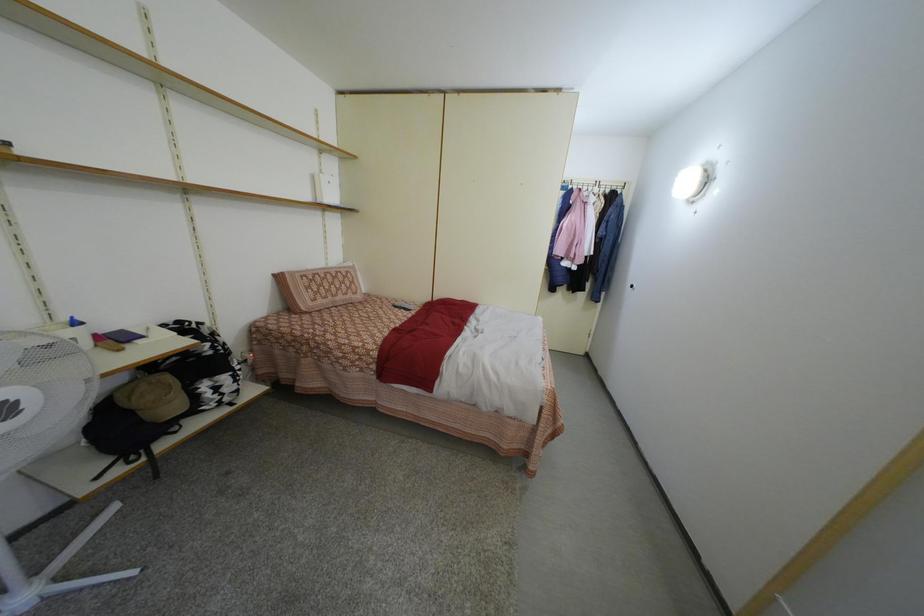
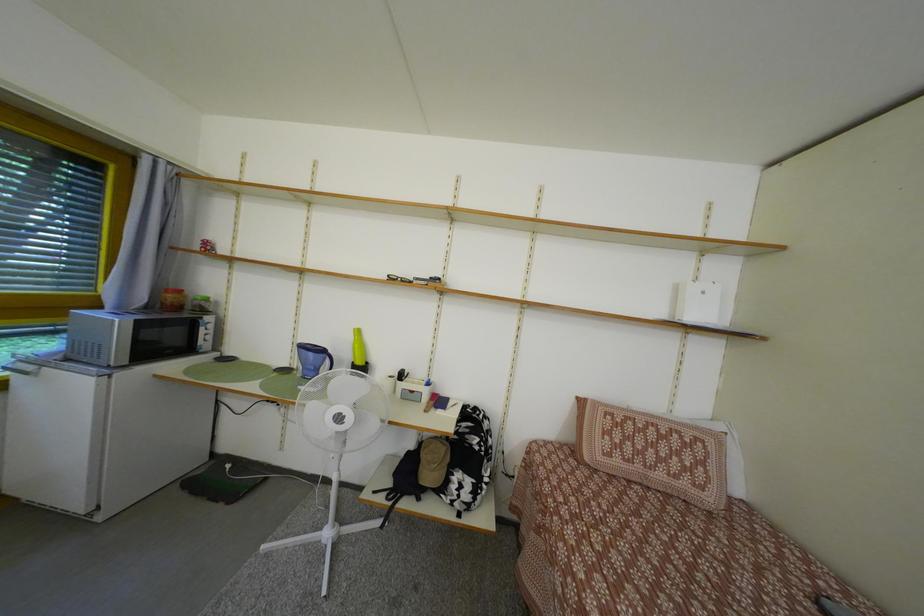
Question: The images are taken continuously from a first-person perspective. In which direction is your viewpoint rotating?

Choices:
 (A) Left
 (B) Right
 (C) Up
 (D) Down

Answer: (A)